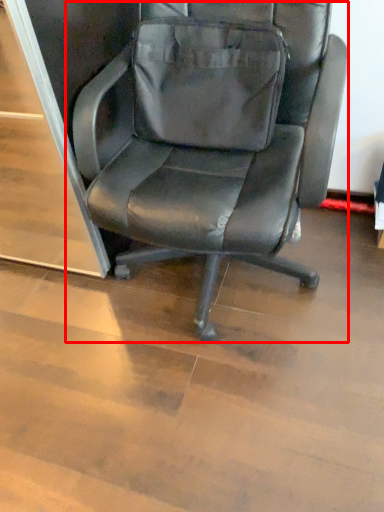
Question: From the image's perspective, where is chair (annotated by the red box) located relative to messenger bag?

Choices:
 (A) below
 (B) above

Answer: (A)